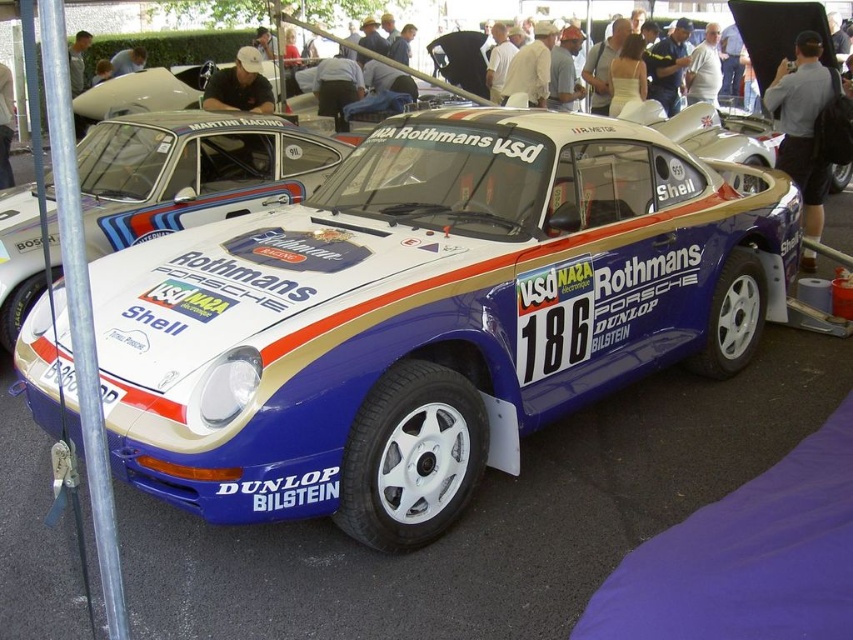
Question: Is matte white porsche at center smaller than light brown leather jacket at upper center?

Choices:
 (A) yes
 (B) no

Answer: (B)

Question: Among these objects, which one is farthest from the camera?

Choices:
 (A) white matte porsche at center
 (B) matte white porsche at center
 (C) gray cotton shirt at upper right
 (D) matte black cap at upper center

Answer: (A)

Question: Considering the real-world distances, which object is farthest from the light brown leather jacket at upper center?

Choices:
 (A) gray cotton shirt at upper right
 (B) white matte porsche at center
 (C) matte white porsche at center
 (D) matte black cap at upper center

Answer: (A)

Question: Does matte white porsche at center have a larger size compared to light brown leather jacket at upper center?

Choices:
 (A) no
 (B) yes

Answer: (B)

Question: Is gray cotton shirt at upper right to the right of light brown leather jacket at upper center from the viewer's perspective?

Choices:
 (A) yes
 (B) no

Answer: (A)

Question: Which object is the closest to the matte white porsche at center?

Choices:
 (A) white matte porsche at center
 (B) matte black cap at upper center
 (C) light brown leather jacket at upper center

Answer: (B)